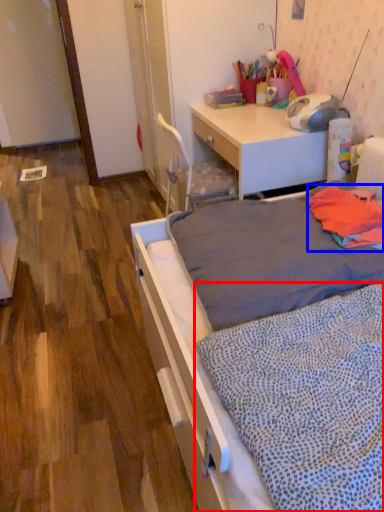
Question: Which of the following is the closest to the observer, blanket (highlighted by a red box) or blanket (highlighted by a blue box)?

Choices:
 (A) blanket
 (B) blanket

Answer: (A)